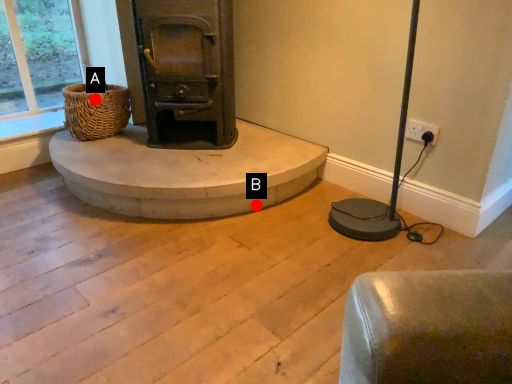
Question: Two points are circled on the image, labeled by A and B beside each circle. Which point is further to the camera?

Choices:
 (A) A is further
 (B) B is further

Answer: (A)